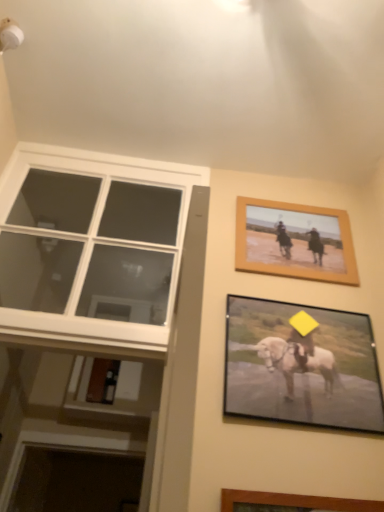
Question: Do you think white glass window at left is within wooden framed picture at upper right, the second picture frame from the front, or outside of it?

Choices:
 (A) outside
 (B) inside

Answer: (A)

Question: From their relative heights in the image, would you say white glass window at left is taller or shorter than wooden framed picture at upper right, marked as the first picture frame in a back-to-front arrangement?

Choices:
 (A) tall
 (B) short

Answer: (A)

Question: Estimate the real-world distances between objects in this image. Which object is farther from the matte black picture frame at lower right, which is the 2th picture frame from back to front?

Choices:
 (A) wooden framed picture at upper right, placed as the 2th picture frame when sorted from bottom to top
 (B) white glass window at left

Answer: (B)

Question: Based on their relative distances, which object is nearer to the wooden framed picture at upper right, marked as the first picture frame in a back-to-front arrangement?

Choices:
 (A) matte black picture frame at lower right, the first picture frame positioned from the front
 (B) white glass window at left

Answer: (A)